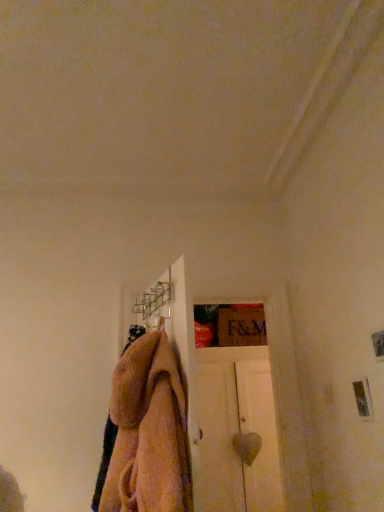
Question: Considering the positions of point (258, 415) and point (168, 412), is point (258, 415) closer or farther from the camera than point (168, 412)?

Choices:
 (A) closer
 (B) farther

Answer: (B)

Question: In terms of size, does white matte door at center appear bigger or smaller than beige fuzzy towel at center-left?

Choices:
 (A) small
 (B) big

Answer: (B)

Question: Is white matte door at center wider or thinner than beige fuzzy towel at center-left?

Choices:
 (A) wide
 (B) thin

Answer: (A)

Question: Is beige fuzzy towel at center-left in front of or behind white matte door at center in the image?

Choices:
 (A) behind
 (B) front

Answer: (B)

Question: From a real-world perspective, is beige fuzzy towel at center-left positioned above or below white matte door at center?

Choices:
 (A) below
 (B) above

Answer: (B)

Question: Considering the positions of beige fuzzy towel at center-left and white matte door at center in the image, is beige fuzzy towel at center-left taller or shorter than white matte door at center?

Choices:
 (A) tall
 (B) short

Answer: (B)

Question: Is point (125, 371) closer or farther from the camera than point (228, 415)?

Choices:
 (A) closer
 (B) farther

Answer: (A)